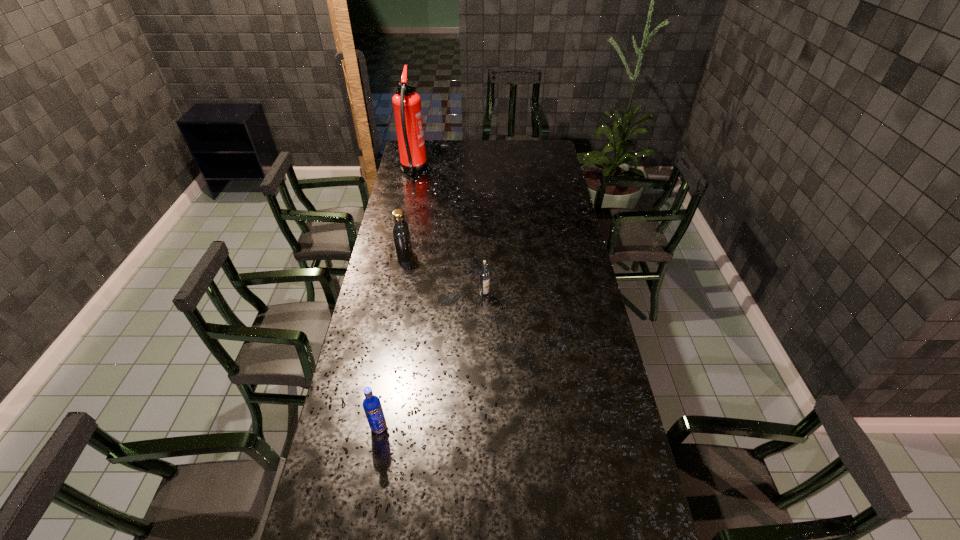
In order to click on object positioned at the far edge in this screenshot , I will do `click(407, 104)`.

The image size is (960, 540). Find the location of `fire extinguisher positioned at the left edge`. fire extinguisher positioned at the left edge is located at coordinates (407, 104).

Find the location of a particular element. Image resolution: width=960 pixels, height=540 pixels. object positioned at the far left corner is located at coordinates (407, 104).

You are a GUI agent. You are given a task and a screenshot of the screen. Output one action in this format:
    pyautogui.click(x=<x>, y=<y>)
    Task: Click on the vacant space at the far edge of the desktop
    The image size is (960, 540).
    Given the screenshot: What is the action you would take?
    (x=519, y=159)

Where is `vacant space at the left edge of the desktop`? The height and width of the screenshot is (540, 960). vacant space at the left edge of the desktop is located at coordinates point(353,366).

This screenshot has height=540, width=960. Identify the location of vacant position at the right edge of the desktop. (569, 221).

The width and height of the screenshot is (960, 540). In order to click on vacant space in between the second nearest object and the nearest vodka in this screenshot , I will do `click(432, 361)`.

Where is `vacant area that lies between the second farthest object and the tallest object`? The height and width of the screenshot is (540, 960). vacant area that lies between the second farthest object and the tallest object is located at coordinates (409, 213).

Identify the location of free space between the tallest object and the third nearest object. This screenshot has height=540, width=960. (409, 213).

I want to click on free space between the nearest vodka and the shortest vodka, so click(x=432, y=361).